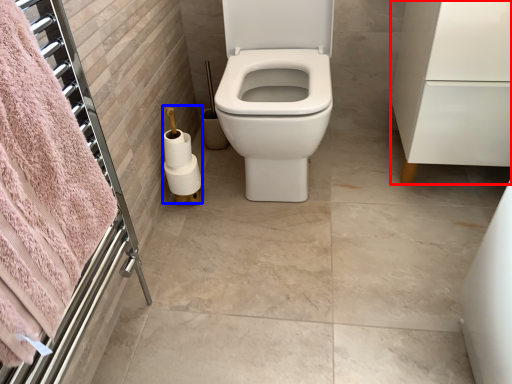
Question: Which object appears closest to the camera in this image, porcelain (highlighted by a red box) or toilet paper (highlighted by a blue box)?

Choices:
 (A) porcelain
 (B) toilet paper

Answer: (A)